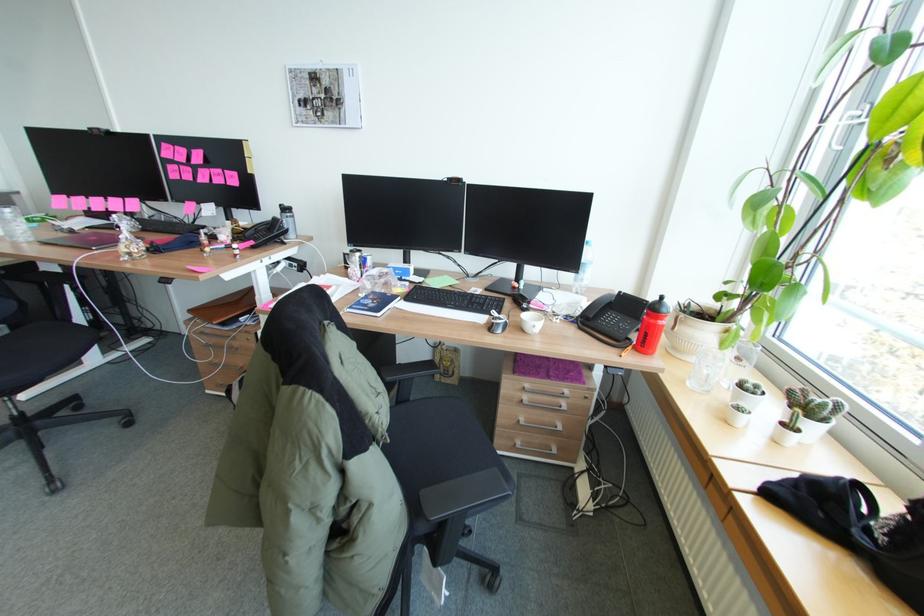
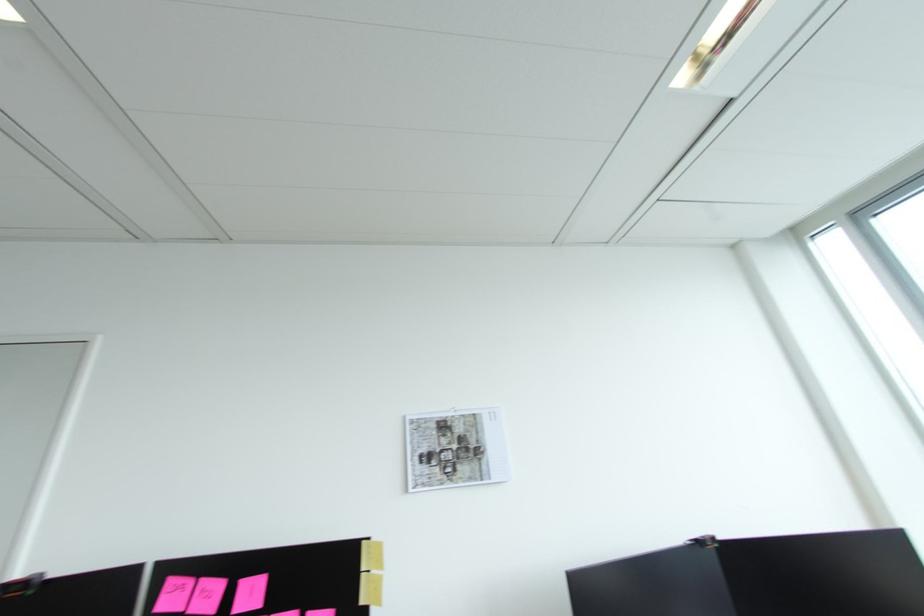
Locate, in the second image, the point that corresponds to [207,161] in the first image.

(262, 605)